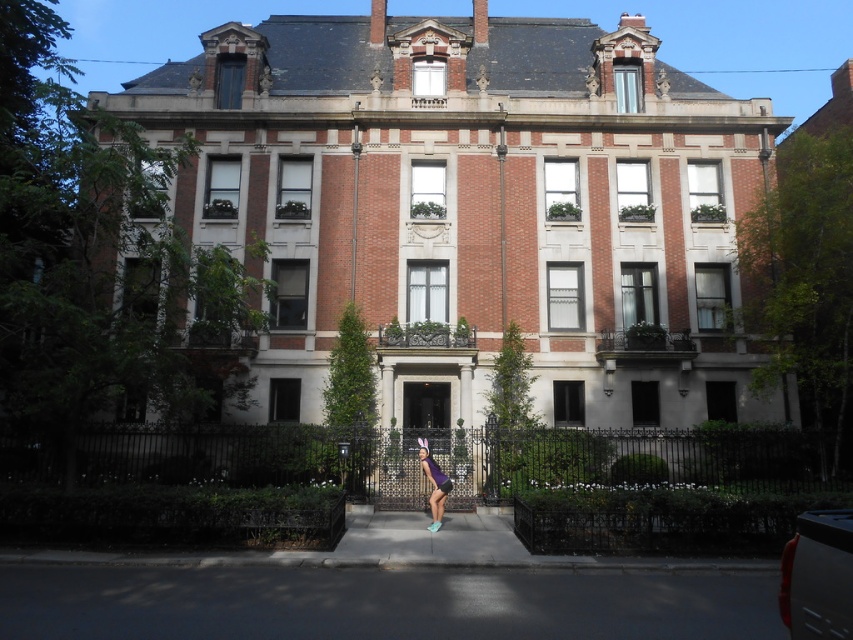
Is purple fabric shorts at center taller than transparent plastic umbrella at center?

Correct, purple fabric shorts at center is much taller as transparent plastic umbrella at center.

I want to click on purple fabric shorts at center, so click(x=434, y=488).

This screenshot has height=640, width=853. I want to click on purple fabric shorts at center, so coord(434,488).